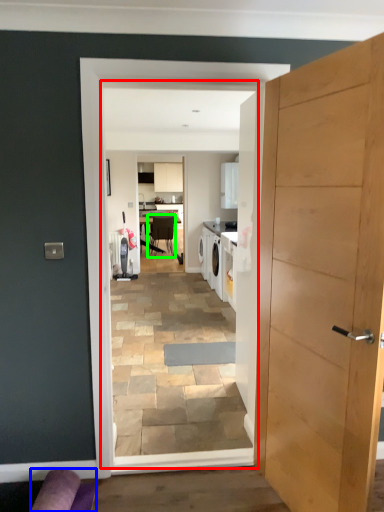
Question: Based on their relative distances, which object is farther from residence (highlighted by a red box)? Choose from couch (highlighted by a blue box) and chair (highlighted by a green box).

Choices:
 (A) couch
 (B) chair

Answer: (B)